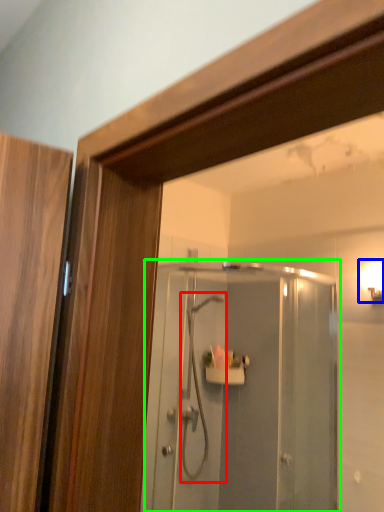
Question: Which is nearer to the shower (highlighted by a red box)? light fixture (highlighted by a blue box) or screen door (highlighted by a green box).

Choices:
 (A) light fixture
 (B) screen door

Answer: (B)